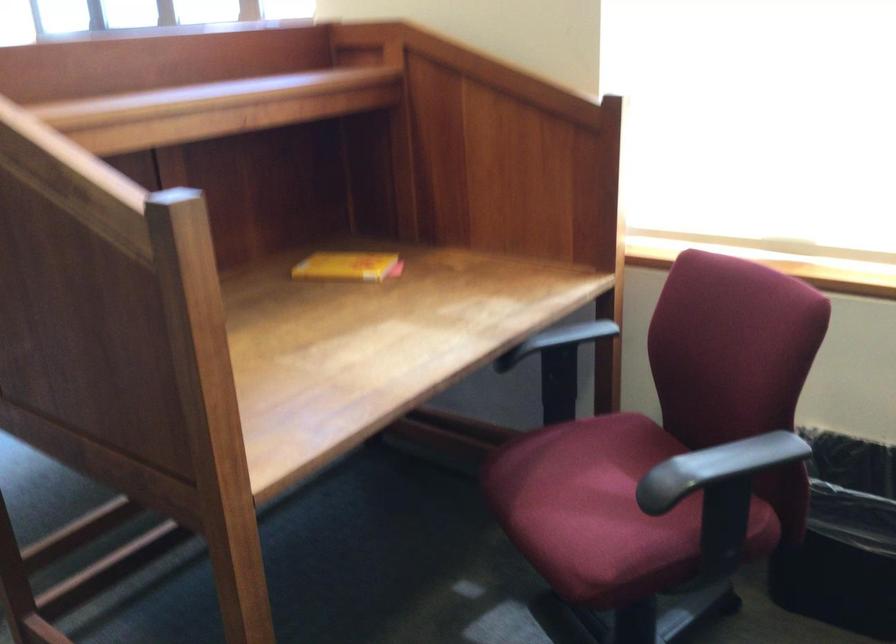
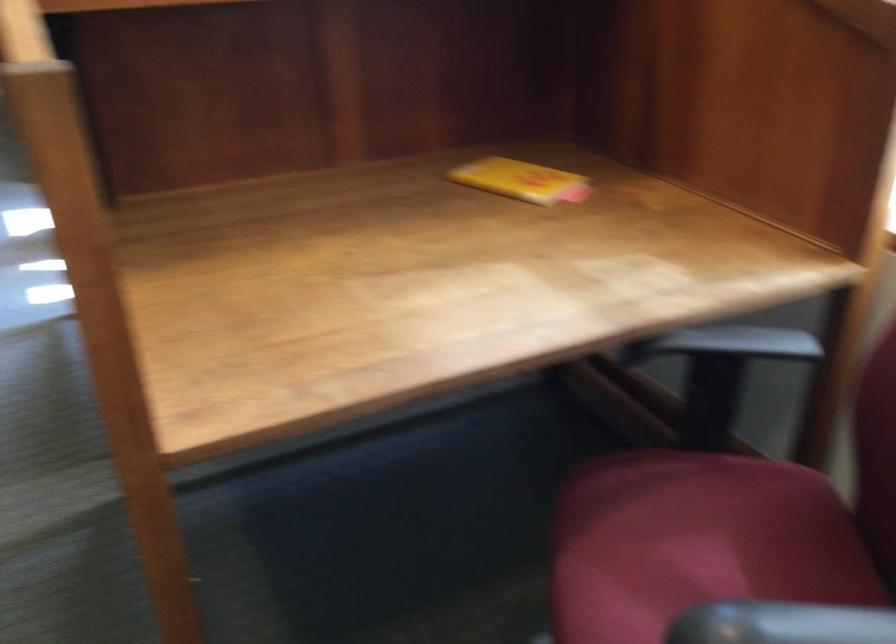
In the second image, find the point that corresponds to (352,267) in the first image.

(521, 180)